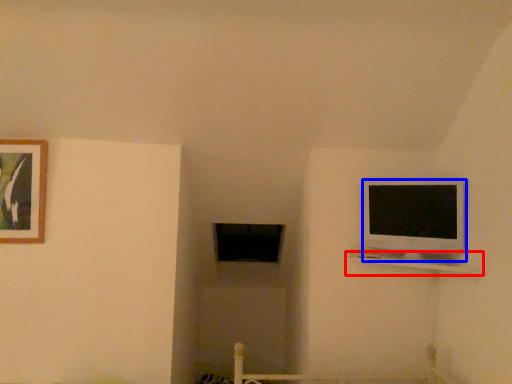
Question: Which of the following is the farthest to the observer, shelf (highlighted by a red box) or television (highlighted by a blue box)?

Choices:
 (A) shelf
 (B) television

Answer: (B)